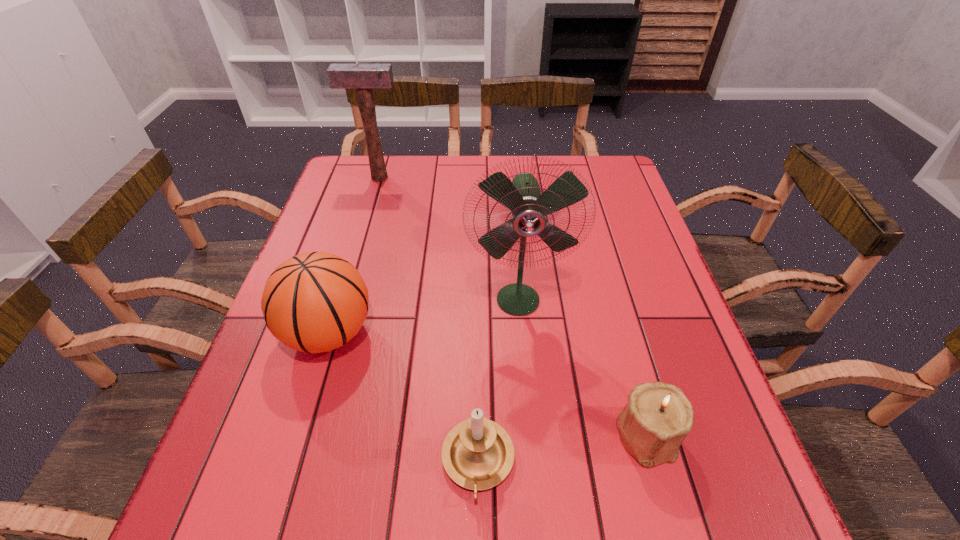
Identify the location of object that is at the far edge. Image resolution: width=960 pixels, height=540 pixels. (363, 77).

Where is `object situated at the near edge`? Image resolution: width=960 pixels, height=540 pixels. object situated at the near edge is located at coordinates (477, 454).

Image resolution: width=960 pixels, height=540 pixels. What are the coordinates of `mallet located in the left edge section of the desktop` in the screenshot? It's located at (363, 77).

At what (x,y) coordinates should I click in order to perform the action: click on basketball that is positioned at the left edge. Please return your answer as a coordinate pair (x, y). Image resolution: width=960 pixels, height=540 pixels. Looking at the image, I should click on (314, 302).

Identify the location of object present at the right edge. click(658, 418).

Locate an element on the screen. This screenshot has height=540, width=960. object located at the far left corner is located at coordinates (363, 77).

Locate an element on the screen. vacant space at the far edge of the desktop is located at coordinates (455, 162).

Where is `free spot at the near edge of the desktop`? The width and height of the screenshot is (960, 540). free spot at the near edge of the desktop is located at coordinates (310, 521).

Where is `vacant space at the left edge of the desktop`? The width and height of the screenshot is (960, 540). vacant space at the left edge of the desktop is located at coordinates (285, 372).

You are a GUI agent. You are given a task and a screenshot of the screen. Output one action in this format:
    pyautogui.click(x=<x>, y=<y>)
    Task: Click on the vacant space at the far right corner of the desktop
    
    Given the screenshot: What is the action you would take?
    pyautogui.click(x=602, y=192)